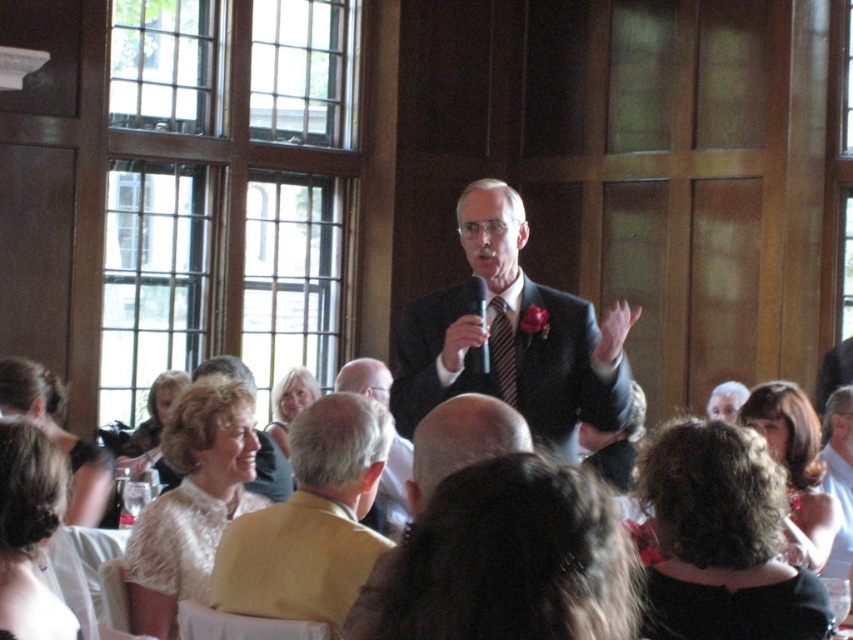
Does matte black suit at center have a greater width compared to dark brown hair at lower right?

Yes, matte black suit at center is wider than dark brown hair at lower right.

Which is more to the left, matte black suit at center or dark brown hair at lower right?

matte black suit at center is more to the left.

Find the location of `matte black suit at center`. matte black suit at center is located at coordinates (514, 337).

Identify the location of matte black suit at center. (514, 337).

Does dark brown hair at center have a greater width compared to dark brown hair at lower right?

Indeed, dark brown hair at center has a greater width compared to dark brown hair at lower right.

Which of these two, dark brown hair at center or dark brown hair at lower right, stands shorter?

Standing shorter between the two is dark brown hair at center.

Is point (480, 592) positioned after point (804, 545)?

No, (480, 592) is closer to viewer.

This screenshot has height=640, width=853. Identify the location of dark brown hair at center. (506, 561).

Does matte black suit at center appear over light brown hair at center?

Yes, matte black suit at center is above light brown hair at center.

Who is positioned more to the right, matte black suit at center or light brown hair at center?

matte black suit at center

Between point (616, 381) and point (289, 404), which one is positioned in front?

Positioned in front is point (616, 381).

Identify the location of matte black suit at center. Image resolution: width=853 pixels, height=640 pixels. (514, 337).